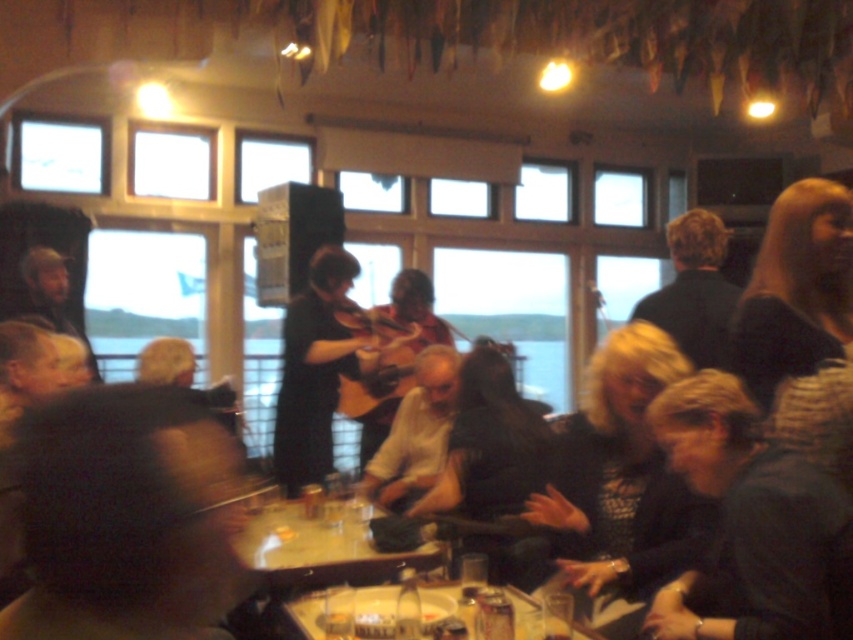
Is the position of black matte shirt at upper right less distant than that of wooden acoustic guitar at center?

Yes, black matte shirt at upper right is in front of wooden acoustic guitar at center.

Where is `black matte shirt at upper right`? black matte shirt at upper right is located at coordinates (694, 291).

How distant is dark gray sweater at center from black matte shirt at upper right?

A distance of 21.59 inches exists between dark gray sweater at center and black matte shirt at upper right.

Find the location of a particular element. Image resolution: width=853 pixels, height=640 pixels. dark gray sweater at center is located at coordinates 622,476.

At what (x,y) coordinates should I click in order to perform the action: click on dark gray sweater at center. Please return your answer as a coordinate pair (x, y). This screenshot has height=640, width=853. Looking at the image, I should click on (622, 476).

Does dark gray sweater at lower right have a lesser width compared to wooden table at center?

Yes, dark gray sweater at lower right is thinner than wooden table at center.

Does dark gray sweater at lower right have a greater width compared to wooden table at center?

In fact, dark gray sweater at lower right might be narrower than wooden table at center.

Identify the location of dark gray sweater at lower right. This screenshot has height=640, width=853. (751, 524).

This screenshot has width=853, height=640. Identify the location of dark gray sweater at lower right. (751, 524).